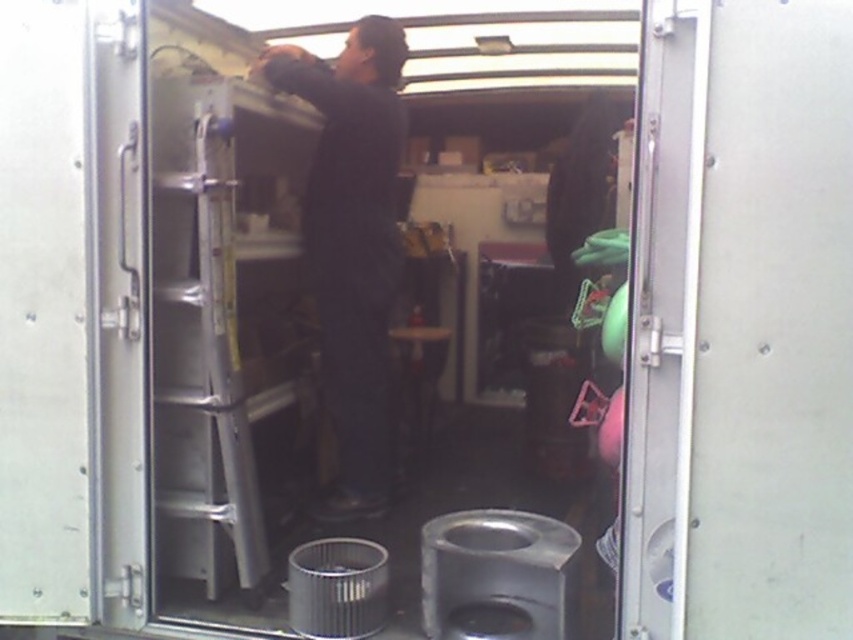
You are a maintenance worker needing to access the ceiling in the trailer. You see the silver metallic ladder at center and the metallic silver door at center. Which object is closer to you, and why?

The silver metallic ladder at center is closer to you because it is positioned further to the viewer than the metallic silver door at center, meaning it is nearer in your line of sight.

You are standing in the trailer and want to reach an object located at point (664,198). The object is 1.56 meters away from you. If your arm can extend 1.2 meters, can you reach it without moving?

The object at point (664,198) is 1.56 meters away from you, which is beyond the 1.2 meter reach of your arm. Therefore, you cannot reach it without moving closer or using a tool.